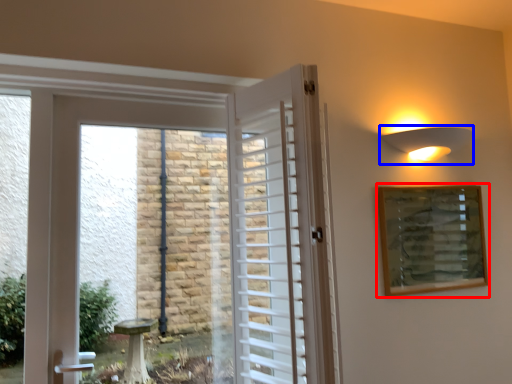
Question: Which of the following is the farthest to the observer, picture frame (highlighted by a red box) or light fixture (highlighted by a blue box)?

Choices:
 (A) picture frame
 (B) light fixture

Answer: (A)